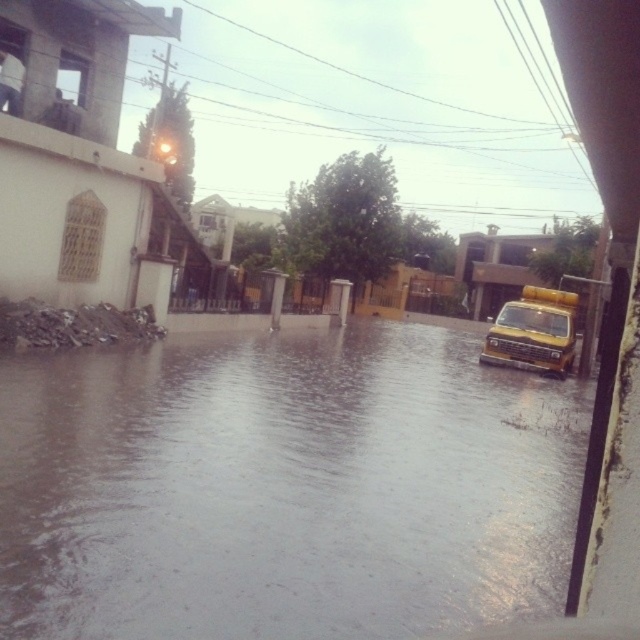
You are standing on the flooded street and want to walk from the point at coordinates point (x=109, y=586) to the point at coordinates point (x=515, y=301). Which direction should you face to move towards the second point?

You should face away from the viewer because point (x=515, y=301) is further away than point (x=109, y=586).